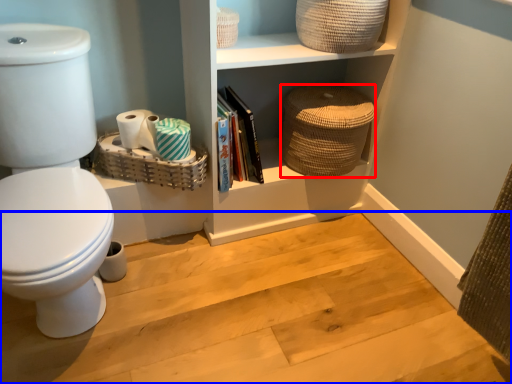
Question: Which of the following is the closest to the observer, basket (highlighted by a red box) or stair (highlighted by a blue box)?

Choices:
 (A) basket
 (B) stair

Answer: (B)